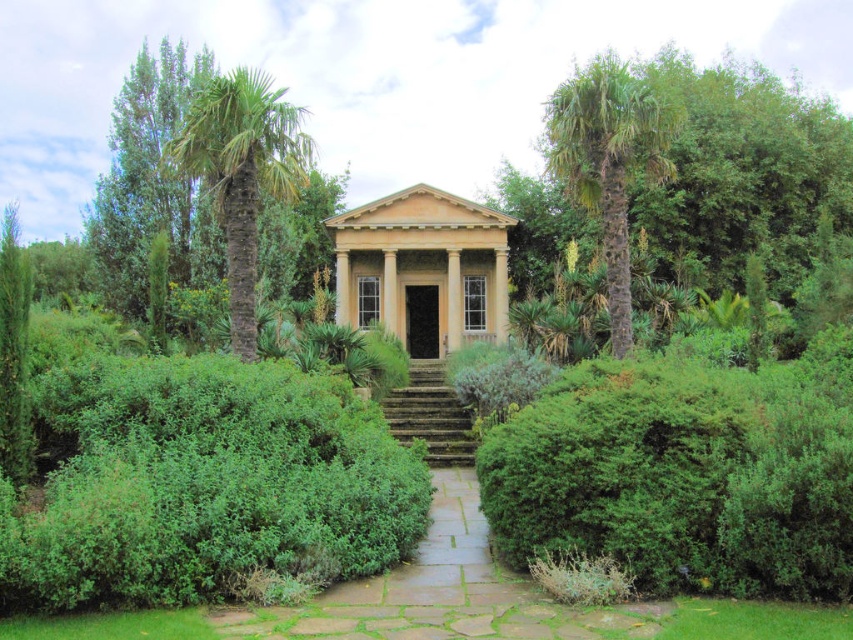
Who is higher up, green leafy hedge at center or green textured palm tree at right?

green textured palm tree at right is above.

Can you confirm if green leafy hedge at center is positioned to the right of green textured palm tree at right?

No, green leafy hedge at center is not to the right of green textured palm tree at right.

Measure the distance between point (x=682, y=556) and camera.

7.02 meters

This screenshot has height=640, width=853. What are the coordinates of `green leafy hedge at center` in the screenshot? It's located at (685, 472).

Does point (410, 243) come behind point (434, 444)?

Yes, it is behind point (434, 444).

Who is higher up, beige stone gazebo at center or stone steps at center?

beige stone gazebo at center

Who is more forward, (469, 248) or (419, 358)?

Point (469, 248) is in front.

Find the location of `beige stone gazebo at center`. beige stone gazebo at center is located at coordinates (422, 268).

Does green textured palm tree at right come in front of stone steps at center?

No.

Between green textured palm tree at right and stone steps at center, which one is positioned higher?

green textured palm tree at right is higher up.

Image resolution: width=853 pixels, height=640 pixels. Find the location of `green textured palm tree at right`. green textured palm tree at right is located at coordinates (608, 160).